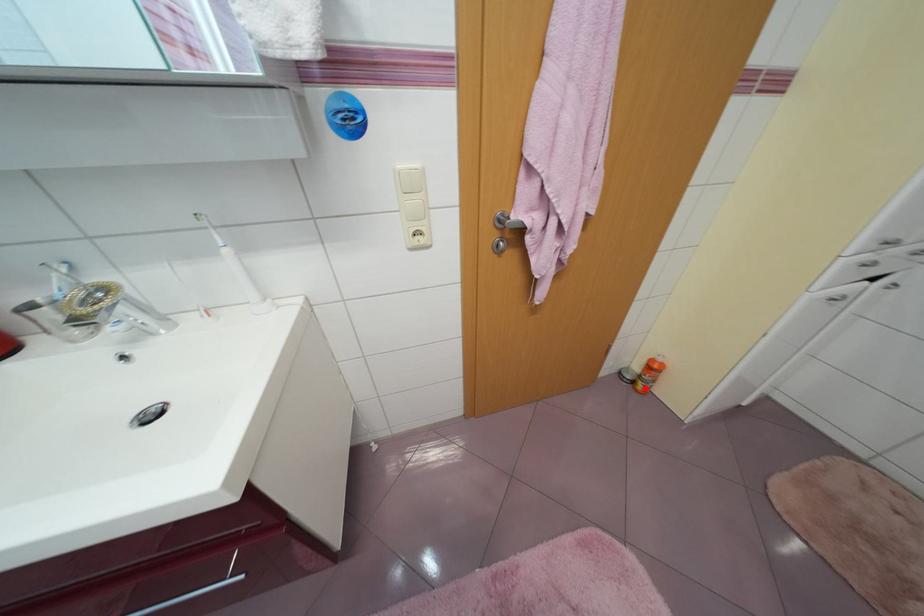
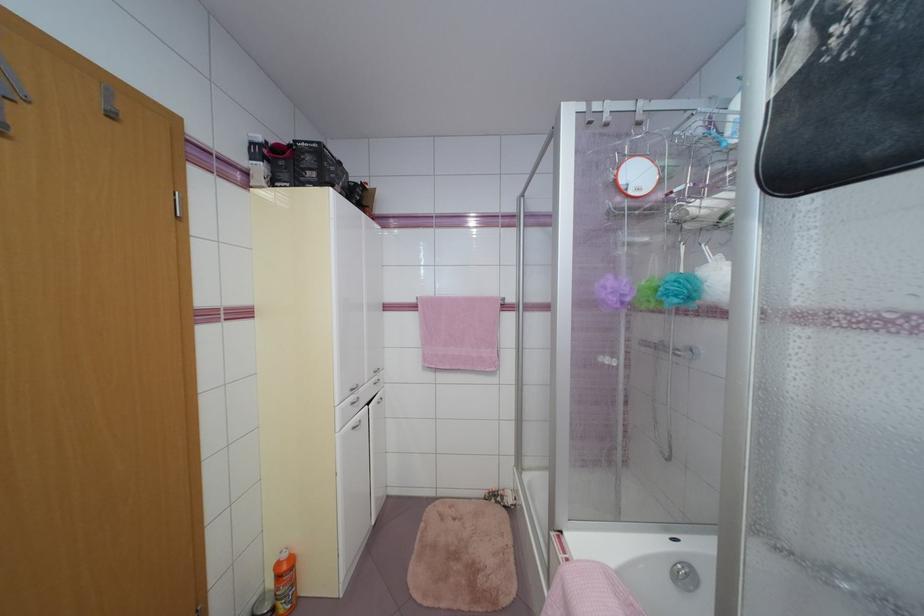
Locate, in the second image, the point that corresponds to the highlighted location in the first image.

(287, 610)